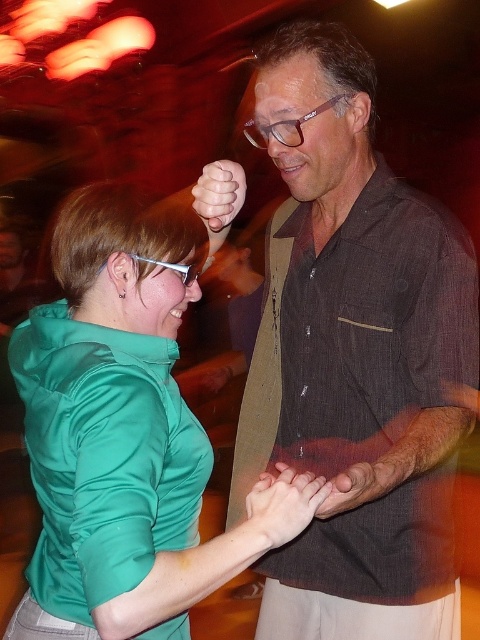
You are at a party and want to take a photo of the green satin blouse at center without the clear plastic glasses at upper left appearing in the frame. Is this possible based on their positions?

The green satin blouse at center is in front of the clear plastic glasses at upper left, so you can take a photo of the green satin blouse at center without the clear plastic glasses at upper left appearing in the frame by positioning the camera so the blouse blocks the view of the glasses.

Looking at this image, what is the color of the clothing item located at the coordinates point [126,433]?

The point [126,433] corresponds to the green satin blouse at center, so the color is green.

You are a photographer at a party and want to capture a closeup shot of the two people in the image. The camera you are using has a limited depth of field that can only focus on one object at a time. Which object should you focus on to ensure the other remains in the frame but slightly blurred? Please choose between the brown textured shirt at center and the smooth skin hand at center.

The brown textured shirt at center is bigger than the smooth skin hand at center. Therefore, focusing on the brown textured shirt at center will keep it sharp while the smaller smooth skin hand at center appears slightly blurred due to the limited depth of field.